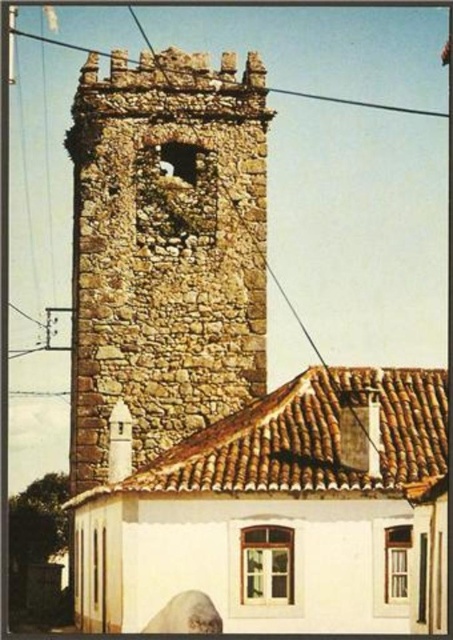
Which is below, brown stone tower at center or metallic wire at upper center?

brown stone tower at center is lower down.

You are a GUI agent. You are given a task and a screenshot of the screen. Output one action in this format:
    pyautogui.click(x=<x>, y=<y>)
    Task: Click on the brown stone tower at center
    
    Given the screenshot: What is the action you would take?
    pyautogui.click(x=164, y=250)